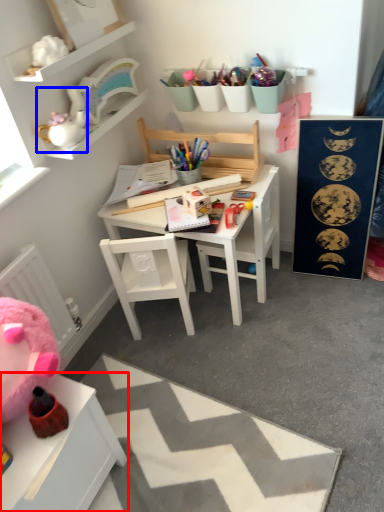
Question: Which object is further to the camera taking this photo, table (highlighted by a red box) or toy (highlighted by a blue box)?

Choices:
 (A) table
 (B) toy

Answer: (B)